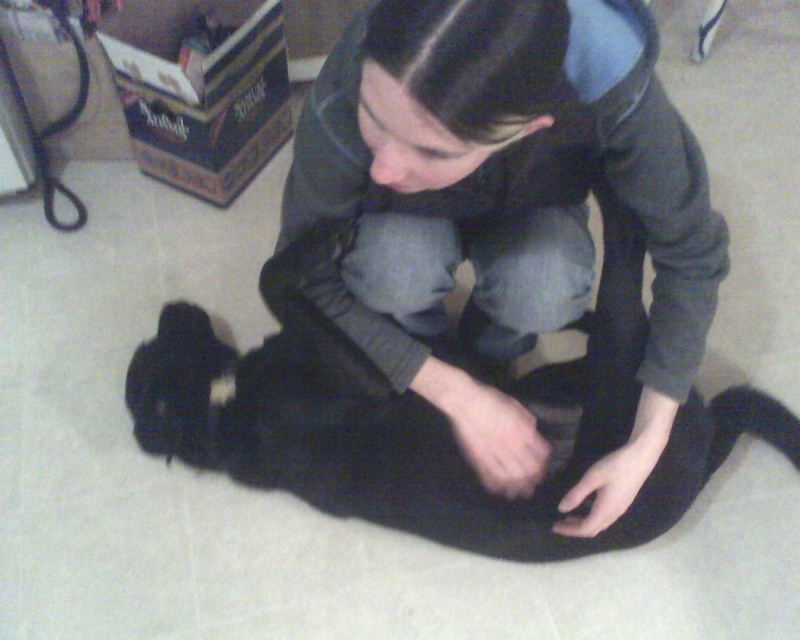
Question: Does dark gray hoodie at center have a smaller size compared to black fur paw at lower center?

Choices:
 (A) yes
 (B) no

Answer: (B)

Question: Which point is closer to the camera?

Choices:
 (A) black fur paw at lower center
 (B) dark gray hoodie at center

Answer: (B)

Question: Estimate the real-world distances between objects in this image. Which object is farther from the black fur cat at center?

Choices:
 (A) dark gray hoodie at center
 (B) black fur paw at lower center

Answer: (A)

Question: Does dark gray hoodie at center have a lesser width compared to black fur paw at lower center?

Choices:
 (A) yes
 (B) no

Answer: (B)

Question: Observing the image, what is the correct spatial positioning of black fur cat at center in reference to black fur paw at lower center?

Choices:
 (A) above
 (B) below

Answer: (A)

Question: Which of the following is the closest to the observer?

Choices:
 (A) dark gray hoodie at center
 (B) black fur cat at center
 (C) black fur paw at lower center

Answer: (A)